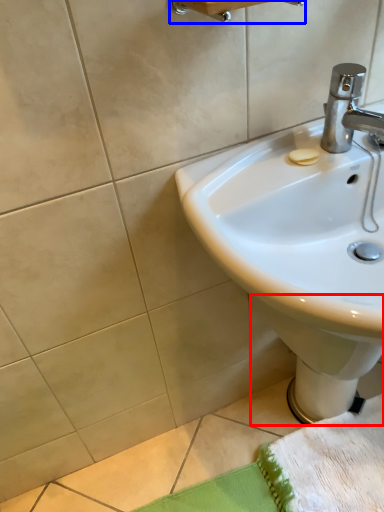
Question: Which object appears closest to the camera in this image, bidet (highlighted by a red box) or towel bar (highlighted by a blue box)?

Choices:
 (A) bidet
 (B) towel bar

Answer: (B)